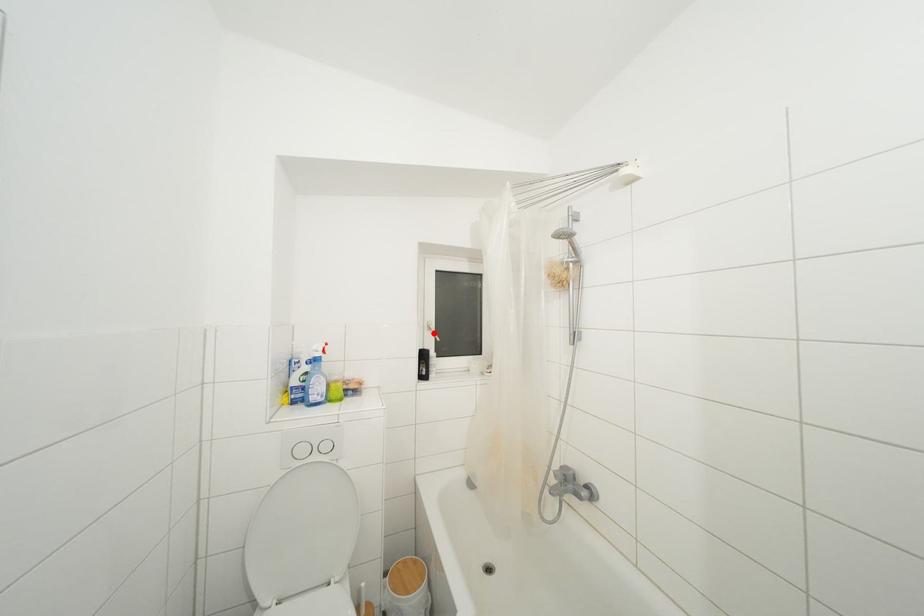
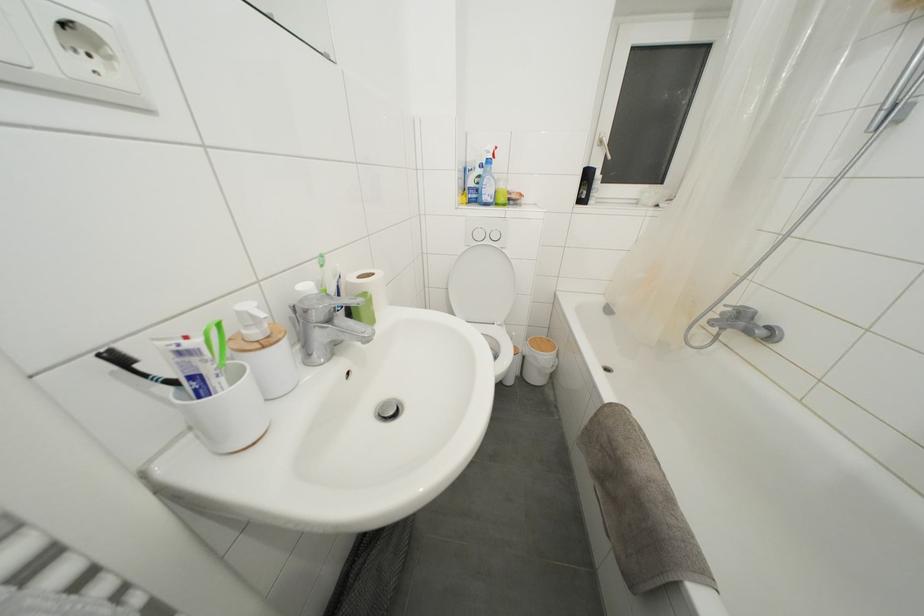
Where in the second image is the point corresponding to the highlighted location from the first image?

(604, 148)